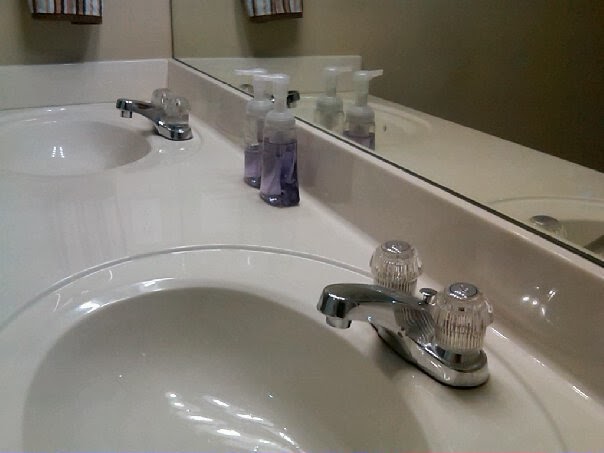
This screenshot has height=453, width=604. What are the coordinates of `mirror` in the screenshot? It's located at (444, 94).